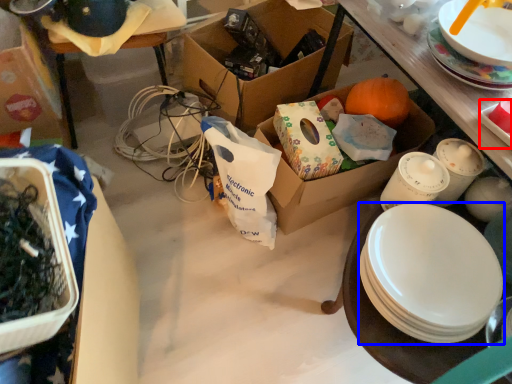
Question: Which object appears closest to the camera in this image, platter (highlighted by a red box) or plate (highlighted by a blue box)?

Choices:
 (A) platter
 (B) plate

Answer: (B)